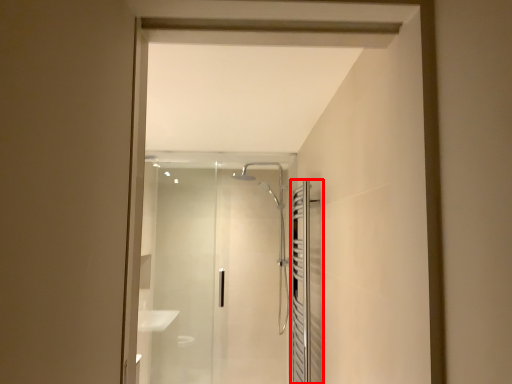
Question: From the image's perspective, what is the correct spatial relationship of screen door (annotated by the red box) in relation to screen door?

Choices:
 (A) below
 (B) above

Answer: (B)